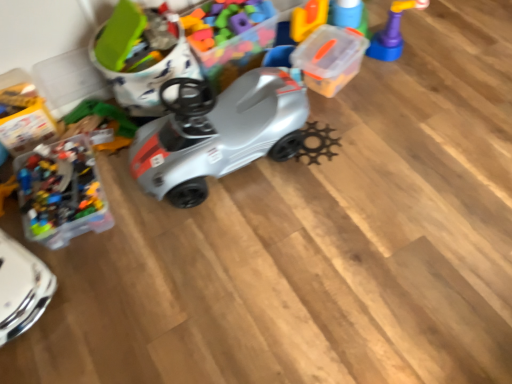
Question: From the image's perspective, is matte plastic toy car at upper left, placed as the third toy when sorted from right to left, on top of transparent plastic container at upper right, the 2th toy viewed from the left?

Choices:
 (A) yes
 (B) no

Answer: (B)

Question: Could you tell me if matte plastic toy car at upper left, placed as the third toy when sorted from right to left, is facing transparent plastic container at upper right, the 2th toy viewed from the left?

Choices:
 (A) yes
 (B) no

Answer: (B)

Question: Is matte plastic toy car at upper left, placed as the third toy when sorted from right to left, positioned behind transparent plastic container at upper right, the 2th toy viewed from the left?

Choices:
 (A) yes
 (B) no

Answer: (B)

Question: Is matte plastic toy car at upper left, placed as the third toy when sorted from right to left, positioned in front of transparent plastic container at upper right, the second toy when ordered from right to left?

Choices:
 (A) no
 (B) yes

Answer: (B)

Question: From a real-world perspective, is matte plastic toy car at upper left, placed as the third toy when sorted from right to left, located beneath transparent plastic container at upper right, the 2th toy viewed from the left?

Choices:
 (A) yes
 (B) no

Answer: (B)

Question: Is matte plastic toy car at upper left, which is counted as the 1th toy, starting from the left, to the right of transparent plastic container at upper right, the second toy when ordered from right to left, from the viewer's perspective?

Choices:
 (A) no
 (B) yes

Answer: (A)

Question: Does rubberized plastic toy at upper right, placed as the 1th toy when sorted from right to left, come behind matte plastic toy car at upper left, placed as the third toy when sorted from right to left?

Choices:
 (A) no
 (B) yes

Answer: (B)

Question: Considering the relative positions of rubberized plastic toy at upper right, acting as the 3th toy starting from the left, and matte plastic toy car at upper left, placed as the third toy when sorted from right to left, in the image provided, is rubberized plastic toy at upper right, acting as the 3th toy starting from the left, to the right of matte plastic toy car at upper left, placed as the third toy when sorted from right to left, from the viewer's perspective?

Choices:
 (A) yes
 (B) no

Answer: (A)

Question: Does rubberized plastic toy at upper right, placed as the 1th toy when sorted from right to left, lie in front of matte plastic toy car at upper left, placed as the third toy when sorted from right to left?

Choices:
 (A) yes
 (B) no

Answer: (B)

Question: Is rubberized plastic toy at upper right, acting as the 3th toy starting from the left, touching matte plastic toy car at upper left, which is counted as the 1th toy, starting from the left?

Choices:
 (A) no
 (B) yes

Answer: (A)

Question: Is rubberized plastic toy at upper right, acting as the 3th toy starting from the left, located outside matte plastic toy car at upper left, placed as the third toy when sorted from right to left?

Choices:
 (A) no
 (B) yes

Answer: (B)

Question: Considering the relative sizes of rubberized plastic toy at upper right, acting as the 3th toy starting from the left, and matte plastic toy car at upper left, placed as the third toy when sorted from right to left, in the image provided, is rubberized plastic toy at upper right, acting as the 3th toy starting from the left, taller than matte plastic toy car at upper left, placed as the third toy when sorted from right to left,?

Choices:
 (A) yes
 (B) no

Answer: (B)

Question: Could you tell me if rubberized plastic toy at upper right, placed as the 1th toy when sorted from right to left, is turned towards transparent plastic container at upper right, the second toy when ordered from right to left?

Choices:
 (A) yes
 (B) no

Answer: (B)